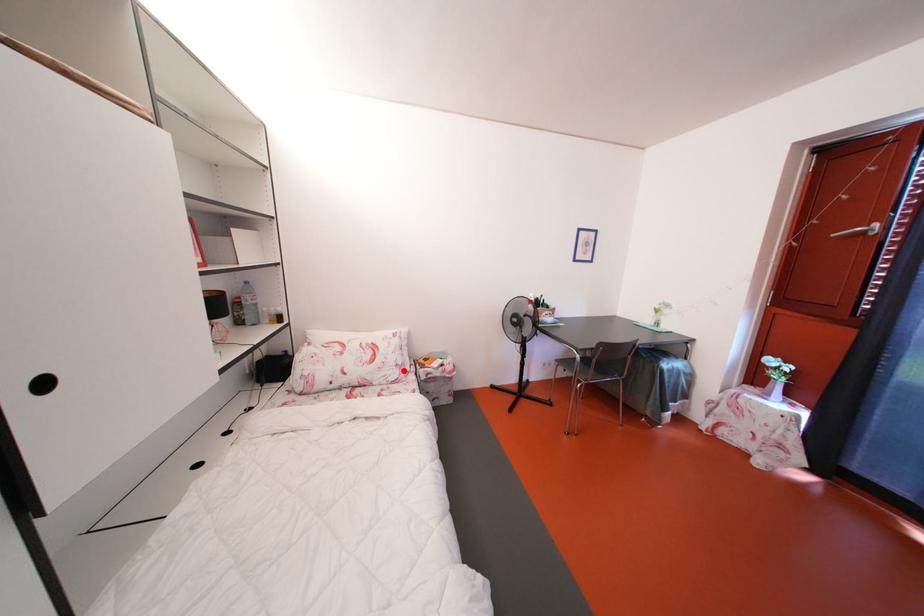
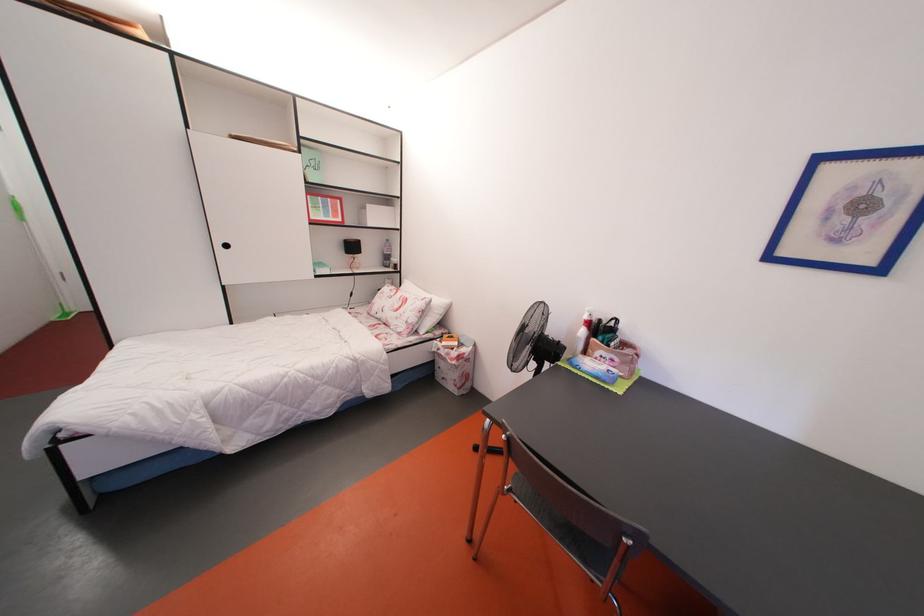
Find the pixel in the second image that matches the highlighted location in the first image.

(414, 328)